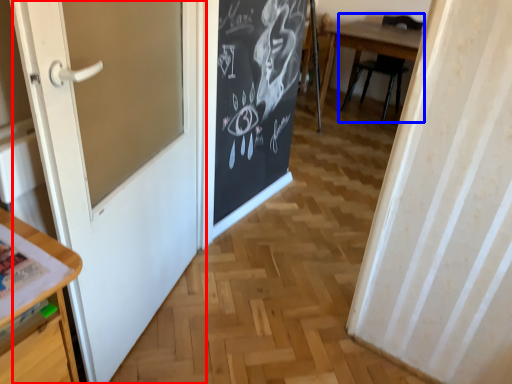
Question: Among these objects, which one is farthest to the camera, door (highlighted by a red box) or chair (highlighted by a blue box)?

Choices:
 (A) door
 (B) chair

Answer: (B)